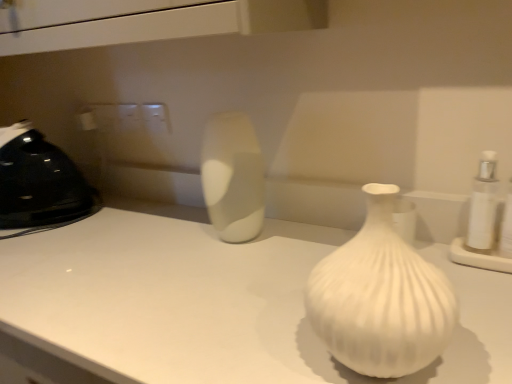
Identify the location of vacant area that is situated to the right of white ribbed vase at center, marked as the 2th vase in a back-to-front arrangement. The width and height of the screenshot is (512, 384). pos(477,328).